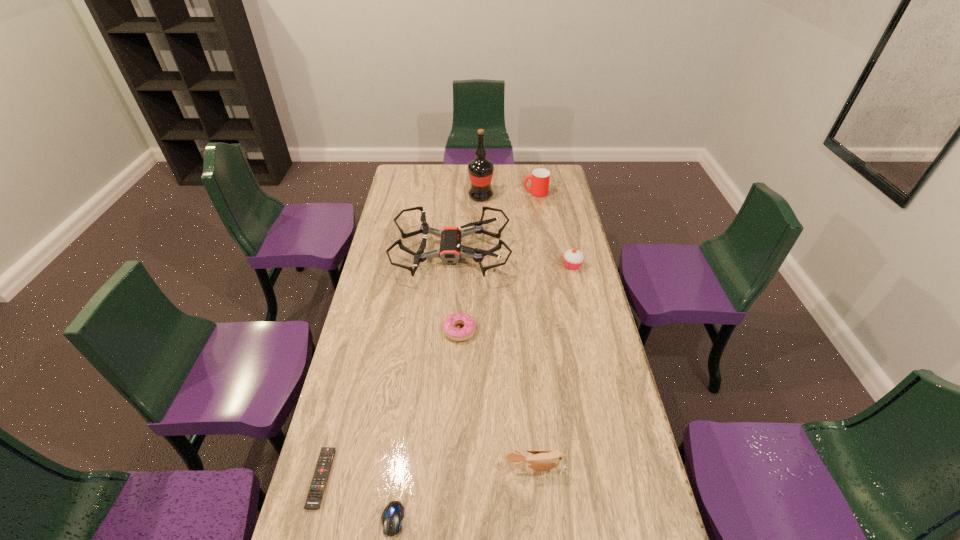
At what (x,y) coordinates should I click in order to perform the action: click on wine bottle. Please return your answer as a coordinate pair (x, y). Looking at the image, I should click on (481, 170).

This screenshot has width=960, height=540. Identify the location of cup. (540, 178).

In order to click on drone in this screenshot , I will do 450,251.

You are a GUI agent. You are given a task and a screenshot of the screen. Output one action in this format:
    pyautogui.click(x=<x>, y=<y>)
    Task: Click on the cupcake
    The height and width of the screenshot is (540, 960).
    Given the screenshot: What is the action you would take?
    pyautogui.click(x=573, y=258)

This screenshot has width=960, height=540. In order to click on bird in this screenshot , I will do `click(541, 460)`.

This screenshot has height=540, width=960. In order to click on the sixth tallest object in this screenshot , I will do `click(456, 334)`.

Where is `the fourth nearest object`? This screenshot has height=540, width=960. the fourth nearest object is located at coordinates (456, 334).

The image size is (960, 540). Find the location of `computer mouse`. computer mouse is located at coordinates (393, 513).

The height and width of the screenshot is (540, 960). Identify the location of remote control. (317, 487).

The height and width of the screenshot is (540, 960). Find the location of `the leftmost object`. the leftmost object is located at coordinates (317, 487).